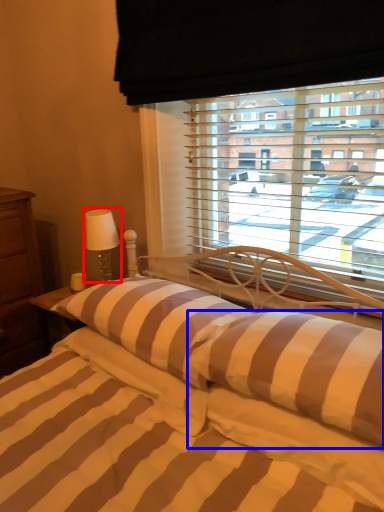
Question: Which object appears farthest to the camera in this image, table lamp (highlighted by a red box) or pillow (highlighted by a blue box)?

Choices:
 (A) table lamp
 (B) pillow

Answer: (A)